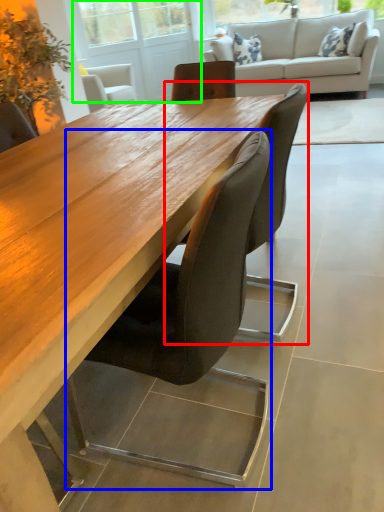
Question: Which is nearer to the chair (highlighted by a red box)? chair (highlighted by a blue box) or screen door (highlighted by a green box).

Choices:
 (A) chair
 (B) screen door

Answer: (A)